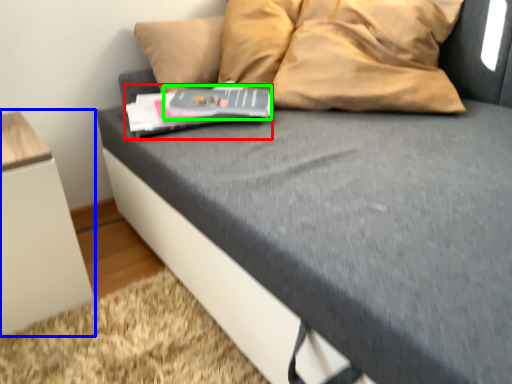
Question: Estimate the real-world distances between objects in this image. Which object is farther from paperback book (highlighted by a red box), furniture (highlighted by a blue box) or paperback book (highlighted by a green box)?

Choices:
 (A) furniture
 (B) paperback book

Answer: (A)